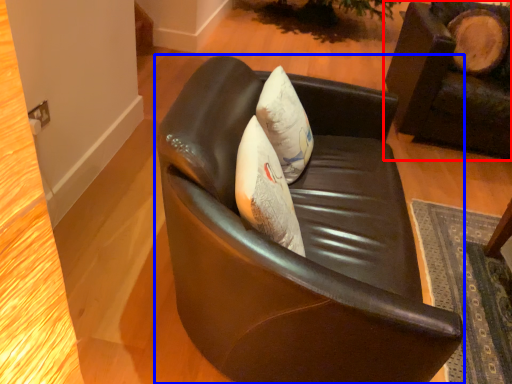
Question: Which object appears farthest to the camera in this image, chair (highlighted by a red box) or chair (highlighted by a blue box)?

Choices:
 (A) chair
 (B) chair

Answer: (A)